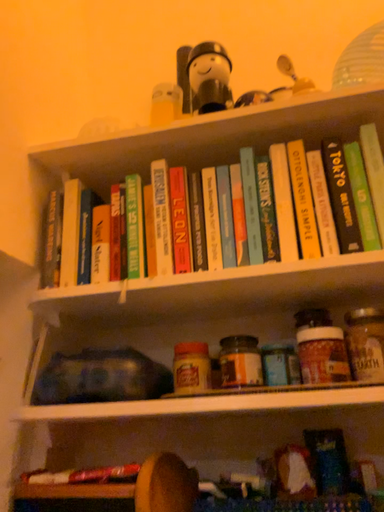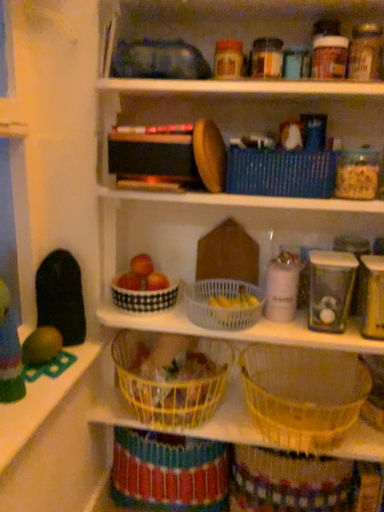
Question: How did the camera likely rotate when shooting the video?

Choices:
 (A) rotated upward
 (B) rotated downward

Answer: (B)